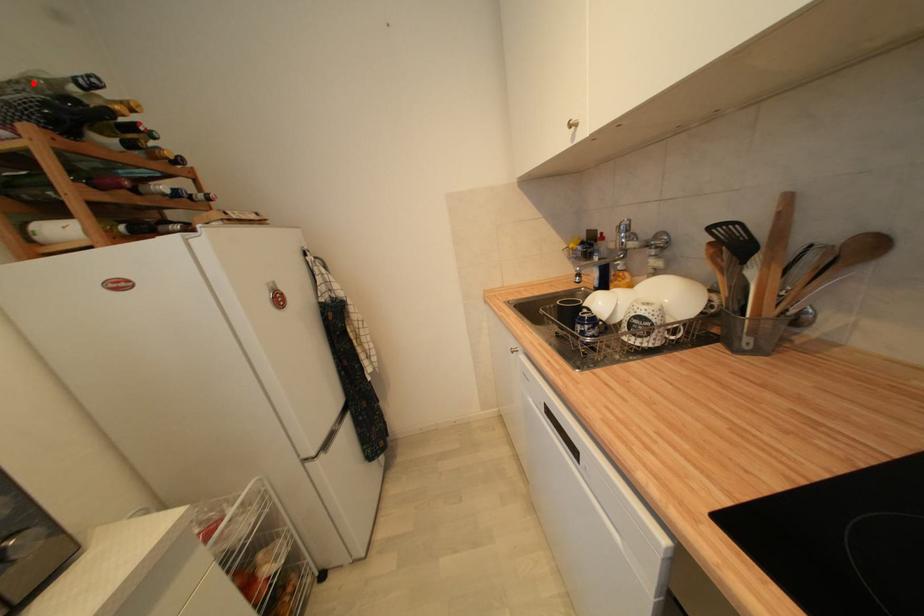
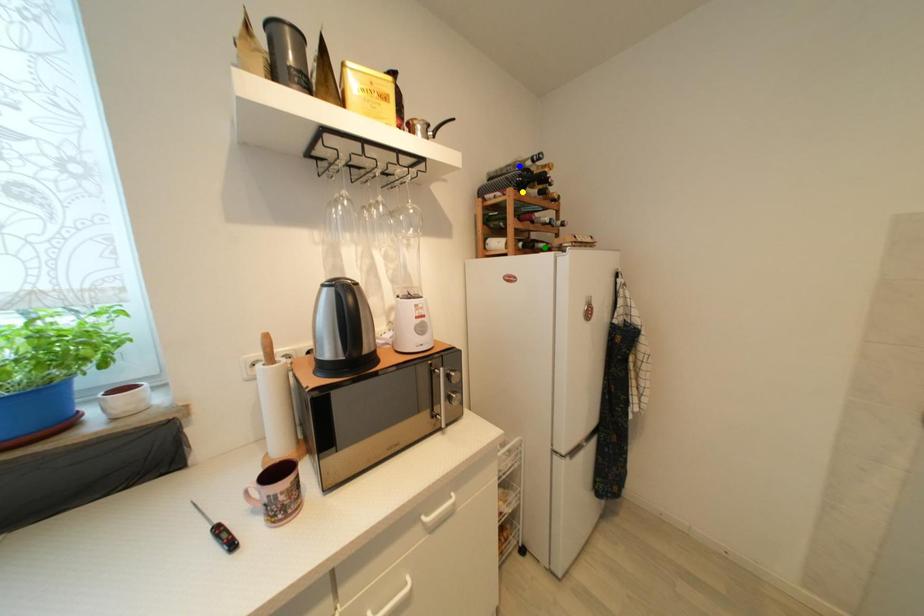
Question: I am providing you with two images of the same scene from different viewpoints. A red point is marked on the first image. You are given multiple points on the second image. In image 2, which mark is for the same physical point as the one in image 1?

Choices:
 (A) green point
 (B) blue point
 (C) yellow point

Answer: (B)